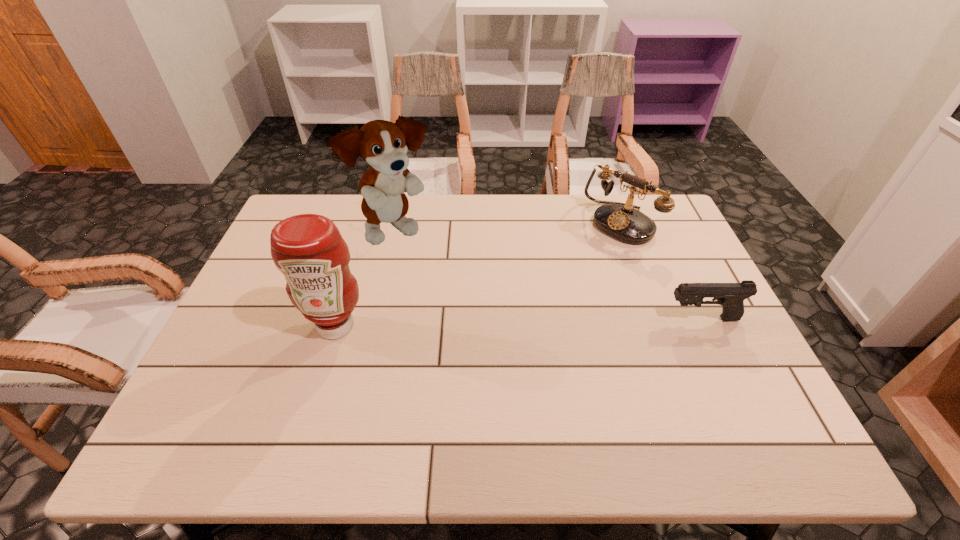
You are a GUI agent. You are given a task and a screenshot of the screen. Output one action in this format:
    pyautogui.click(x=<x>, y=<y>)
    Task: Click on the vacant region located on the face of the puppy
    
    Given the screenshot: What is the action you would take?
    pyautogui.click(x=445, y=267)

Where is `vacant position located on the dial of the second shortest object`? The width and height of the screenshot is (960, 540). vacant position located on the dial of the second shortest object is located at coordinates (531, 300).

You are a GUI agent. You are given a task and a screenshot of the screen. Output one action in this format:
    pyautogui.click(x=<x>, y=<y>)
    Task: Click on the vacant space located 0.280m on the dial of the second shortest object
    
    Given the screenshot: What is the action you would take?
    pyautogui.click(x=547, y=286)

Find the location of `vacant space situated on the dial of the second shortest object`. vacant space situated on the dial of the second shortest object is located at coordinates point(576,262).

This screenshot has width=960, height=540. In order to click on puppy that is at the far edge in this screenshot , I will do `click(382, 144)`.

Locate an element on the screen. This screenshot has height=540, width=960. telephone at the far edge is located at coordinates (621, 221).

This screenshot has height=540, width=960. In order to click on pistol present at the right edge in this screenshot , I will do `click(731, 296)`.

Locate an element on the screen. The height and width of the screenshot is (540, 960). telephone located at the right edge is located at coordinates (621, 221).

I want to click on object that is at the far right corner, so click(621, 221).

The height and width of the screenshot is (540, 960). What are the coordinates of `free space at the far edge of the desktop` in the screenshot? It's located at (594, 210).